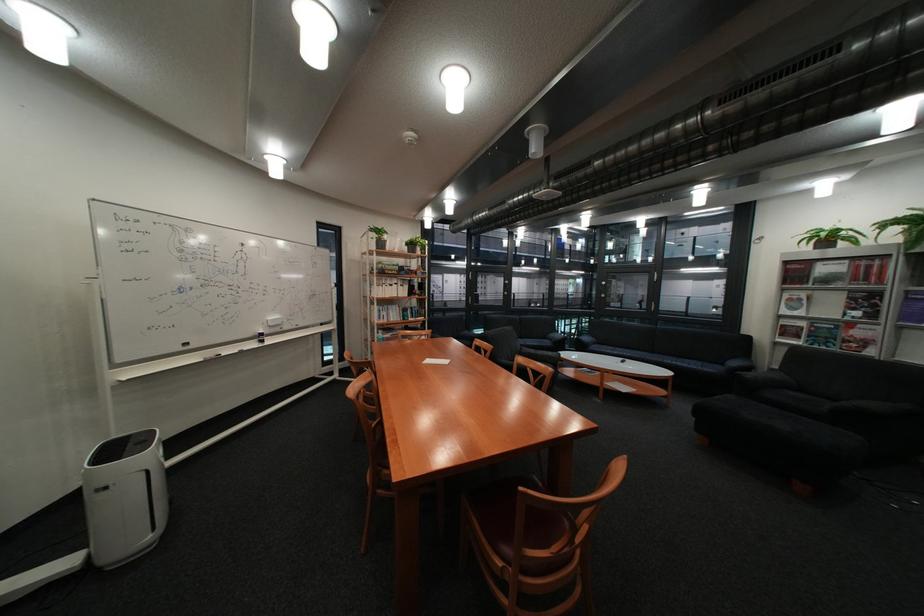
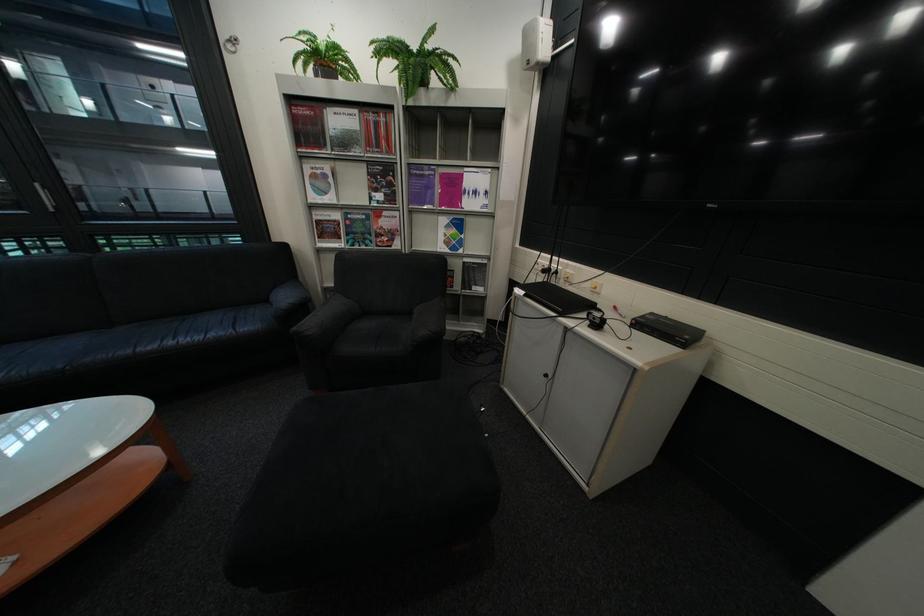
The point at (831, 246) is marked in the first image. Where is the corresponding point in the second image?

(333, 78)